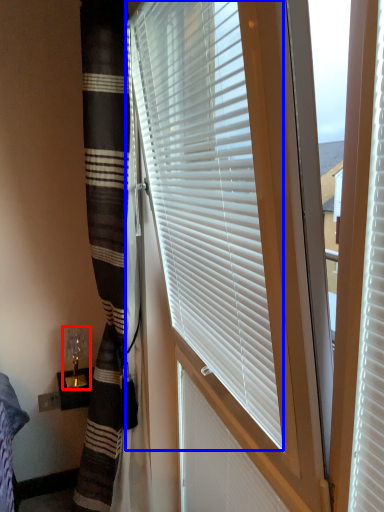
Question: Which point is further to the camera, table lamp (highlighted by a red box) or window blind (highlighted by a blue box)?

Choices:
 (A) table lamp
 (B) window blind

Answer: (A)